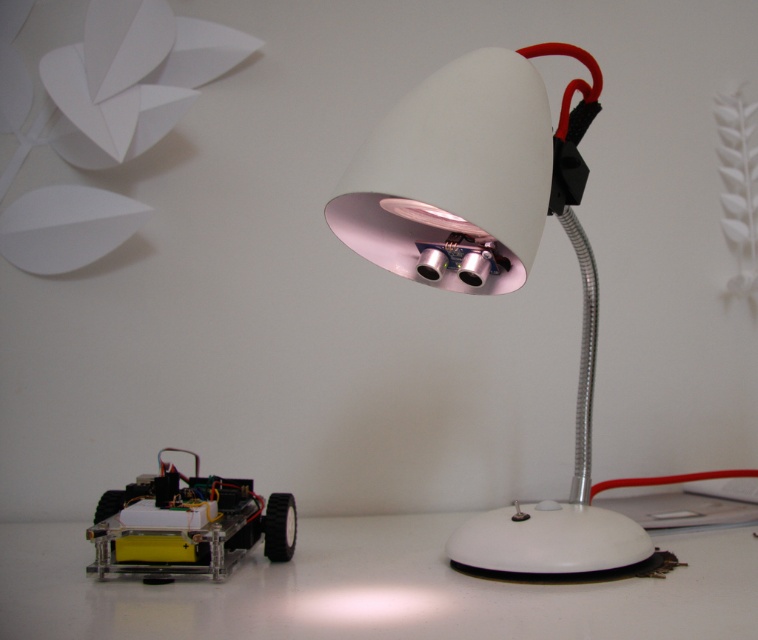
You are a technician examining the workspace. You need to access the clear acrylic toy car at lower left for maintenance. Is the white glossy desk lamp at center blocking your direct path to it?

The white glossy desk lamp at center is positioned over clear acrylic toy car at lower left, so it is blocking the direct path to the car.

You are standing at the origin point of the coordinate system. You want to place a small robotic vehicle on the white glossy table at lower left. What are the coordinates where you should place it?

The coordinates for the white glossy table at lower left are at point (371, 589). So you should place the robotic vehicle at coordinates (371, 589).

Looking at this image, you are organizing the workspace and want to place a new item between the white glossy table at lower left and the white glossy desk lamp at center. Is there enough vertical space between them for a 10 cm tall object?

The white glossy table at lower left is located below the white glossy desk lamp at center, so there is sufficient vertical space between them to accommodate a 10 cm tall object.